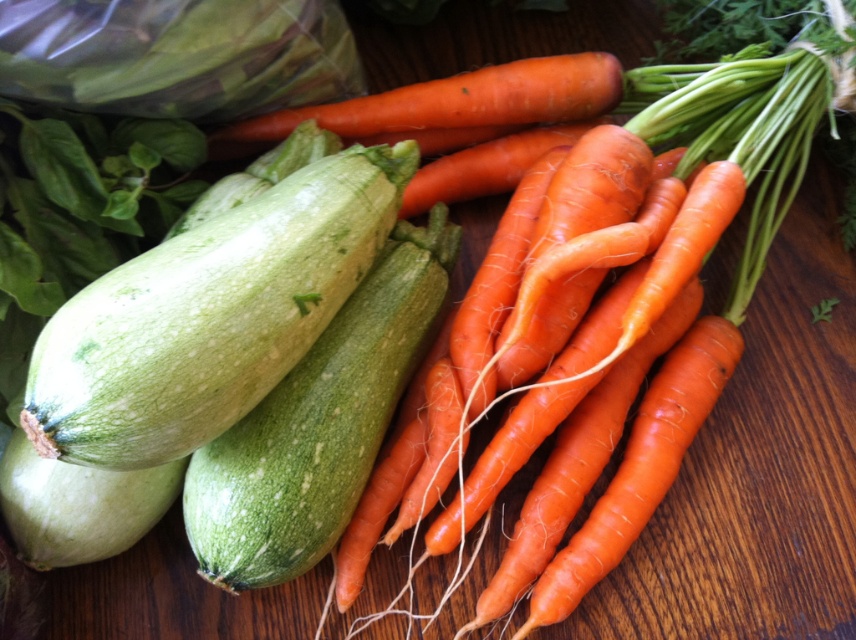
Is point (290, 177) farther from viewer compared to point (351, 541)?

No, (290, 177) is in front of (351, 541).

Does green matte zucchini at left have a larger size compared to orange smooth carrot at center?

No, green matte zucchini at left is not bigger than orange smooth carrot at center.

Identify the location of green matte zucchini at left. The height and width of the screenshot is (640, 856). (209, 316).

Is orange smooth carrot at center positioned in front of orange matte carrot at center?

Yes, orange smooth carrot at center is closer to the viewer.

Does orange smooth carrot at center have a greater height compared to orange matte carrot at center?

Indeed, orange smooth carrot at center has a greater height compared to orange matte carrot at center.

Describe the element at coordinates (438, 400) in the screenshot. Image resolution: width=856 pixels, height=640 pixels. I see `orange smooth carrot at center` at that location.

This screenshot has height=640, width=856. I want to click on orange smooth carrot at center, so click(438, 400).

Is green matte zucchini at left positioned at the back of orange matte carrot at center?

No, it is not.

Where is `green matte zucchini at left`? green matte zucchini at left is located at coordinates [209, 316].

Where is `green matte zucchini at left`? green matte zucchini at left is located at coordinates (209, 316).